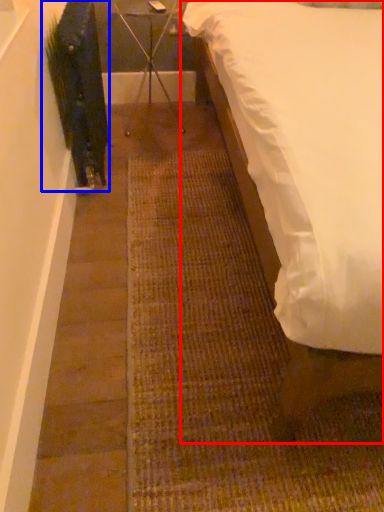
Question: Which of the following is the farthest to the observer, bed (highlighted by a red box) or plant (highlighted by a blue box)?

Choices:
 (A) bed
 (B) plant

Answer: (B)